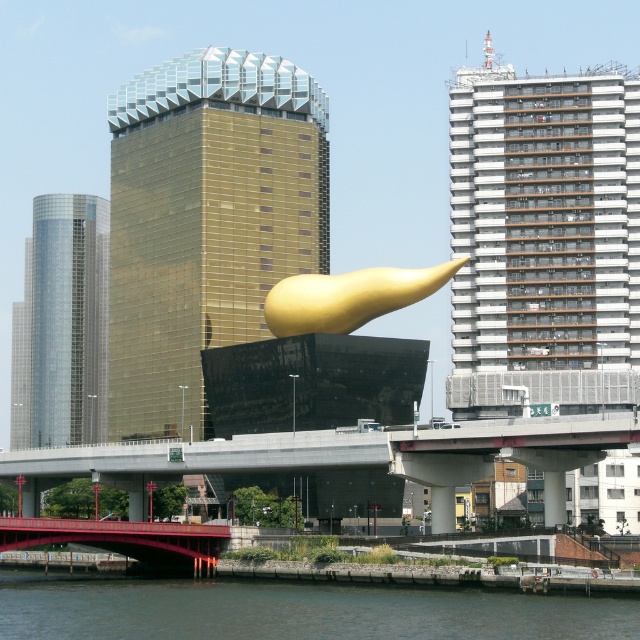
Can you confirm if shiny glass skyscraper at left is positioned above metallic red bridge at lower center?

Yes, shiny glass skyscraper at left is above metallic red bridge at lower center.

Does shiny glass skyscraper at left have a greater height compared to metallic red bridge at lower center?

Indeed, shiny glass skyscraper at left has a greater height compared to metallic red bridge at lower center.

Who is more forward, [77,420] or [80,541]?

Positioned in front is point [80,541].

The image size is (640, 640). I want to click on shiny glass skyscraper at left, so click(x=61, y=324).

Looking at this image, does dark gray water at lower left have a lesser width compared to shiny glass skyscraper at left?

In fact, dark gray water at lower left might be wider than shiny glass skyscraper at left.

Is dark gray water at lower left to the left of shiny glass skyscraper at left from the viewer's perspective?

In fact, dark gray water at lower left is to the right of shiny glass skyscraper at left.

Find the location of a particular element. dark gray water at lower left is located at coordinates (294, 611).

This screenshot has height=640, width=640. Find the location of `dark gray water at lower left`. dark gray water at lower left is located at coordinates (294, 611).

Does gold reflective glass building at center have a larger size compared to shiny glass skyscraper at left?

Actually, gold reflective glass building at center might be smaller than shiny glass skyscraper at left.

Image resolution: width=640 pixels, height=640 pixels. Describe the element at coordinates (205, 221) in the screenshot. I see `gold reflective glass building at center` at that location.

In order to click on gold reflective glass building at center in this screenshot , I will do `click(205, 221)`.